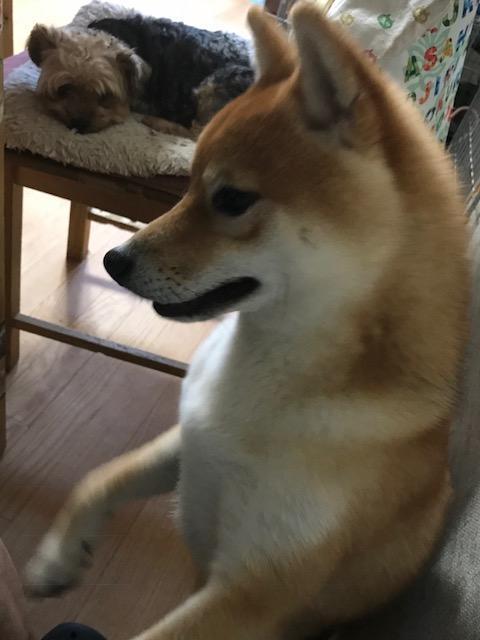
At what (x,y) coordinates should I click in order to perform the action: click on cloth. Please return your answer as a coordinate pair (x, y). Image resolution: width=480 pixels, height=640 pixels. Looking at the image, I should click on (418, 41), (134, 139).